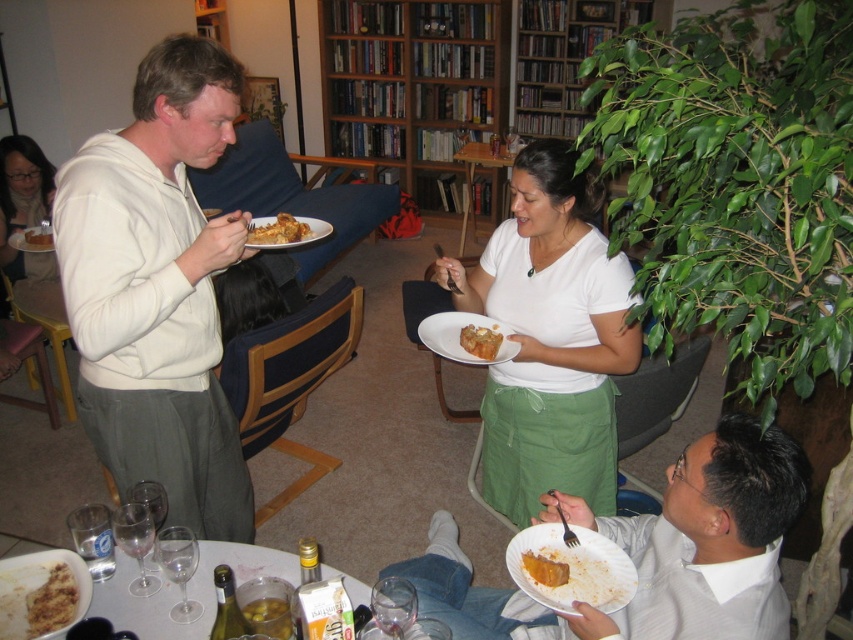
You are standing in the living room and want to pick up an item from the table. You notice two points on the table marked as point 1 and point 2. Point 1 is at coordinate (123, 154) and point 2 is at coordinate (674, 547). Which point is closer to you?

Point 1 at coordinate (123, 154) is closer to you because it is further to the camera than point 2 at coordinate (674, 547).

You are a guest at this gathering and want to choose between the golden brown flaky pastry at upper center and the matte white plate at upper left. Which item is larger in size?

The golden brown flaky pastry at upper center is bigger than the matte white plate at upper left.